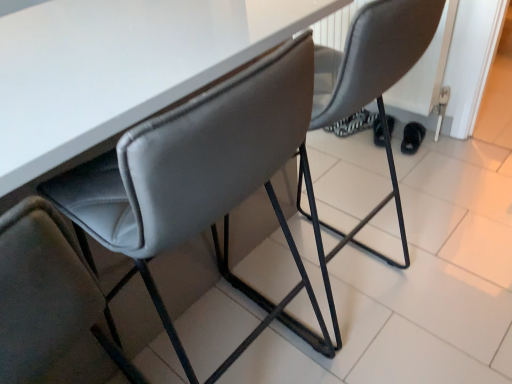
Question: Visually, is matte gray chair at center, the first chair when ordered from right to left, positioned to the left or to the right of black fuzzy slipper at lower right?

Choices:
 (A) right
 (B) left

Answer: (B)

Question: Is matte gray chair at center, the first chair when ordered from right to left, in front of or behind black fuzzy slipper at lower right in the image?

Choices:
 (A) behind
 (B) front

Answer: (B)

Question: Based on their relative distances, which object is farther from the black fuzzy slipper at lower right?

Choices:
 (A) matte gray chair at center, the first chair when ordered from right to left
 (B) suede-like gray chair at center, the 1th chair from the left

Answer: (B)

Question: Estimate the real-world distances between objects in this image. Which object is farther from the black fuzzy slipper at lower right?

Choices:
 (A) matte gray chair at center, the first chair when ordered from right to left
 (B) suede-like gray chair at center, which ranks as the 2th chair in right-to-left order

Answer: (B)